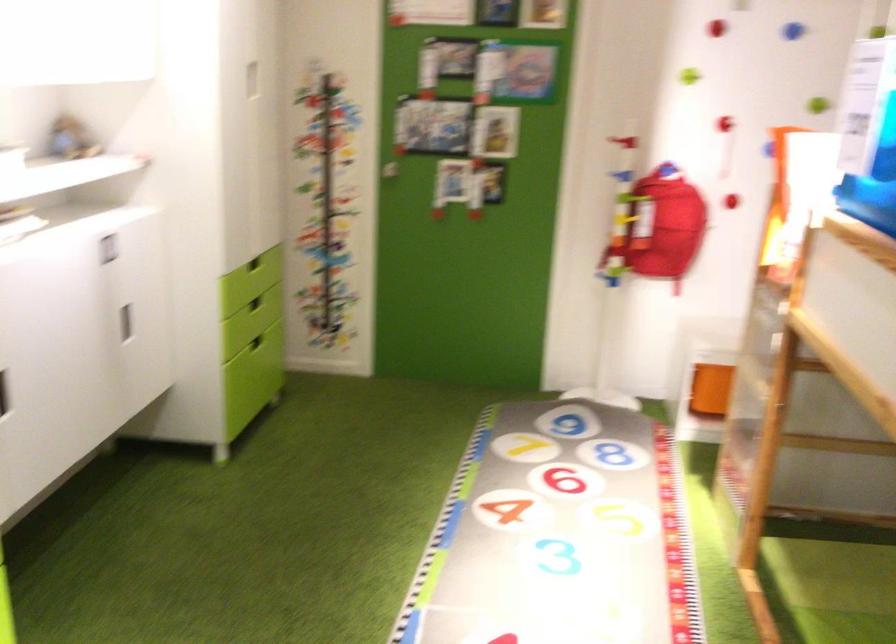
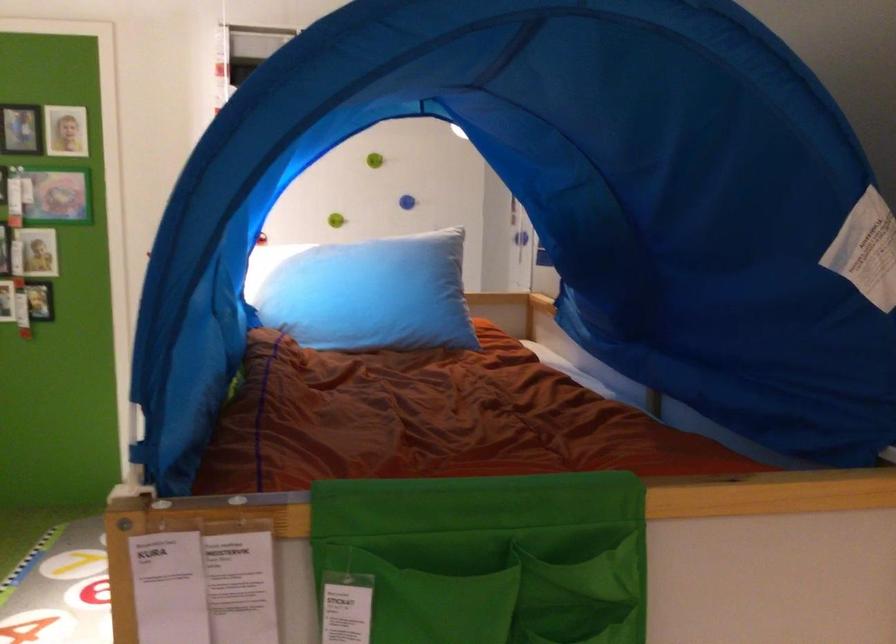
Question: I am providing you with two images of the same scene from different viewpoints. After the viewpoint changes to image2, which objects are now occluded?

Choices:
 (A) green wall knob
 (B) blue wall knob
 (C) conference speaker
 (D) green climbing hold

Answer: (D)